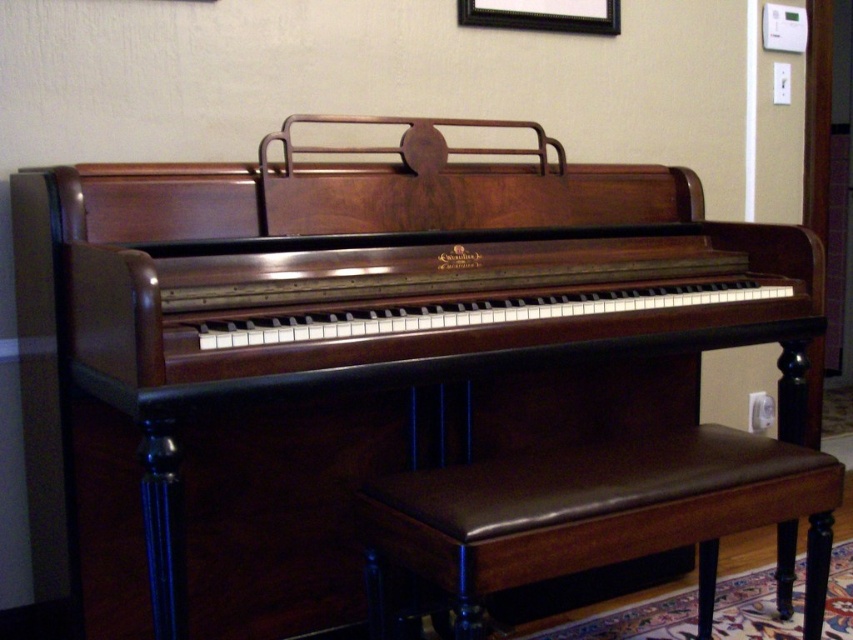
Question: Among these points, which one is nearest to the camera?

Choices:
 (A) (523, 19)
 (B) (810, 531)

Answer: (B)

Question: Observing the image, what is the correct spatial positioning of brown leather stool at center in reference to black wood picture frame at upper center?

Choices:
 (A) above
 (B) below

Answer: (B)

Question: Does brown leather stool at center lie behind black wood picture frame at upper center?

Choices:
 (A) yes
 (B) no

Answer: (B)

Question: Does brown leather stool at center have a greater width compared to black wood picture frame at upper center?

Choices:
 (A) no
 (B) yes

Answer: (B)

Question: Among these objects, which one is nearest to the camera?

Choices:
 (A) black wood picture frame at upper center
 (B) brown leather stool at center

Answer: (B)